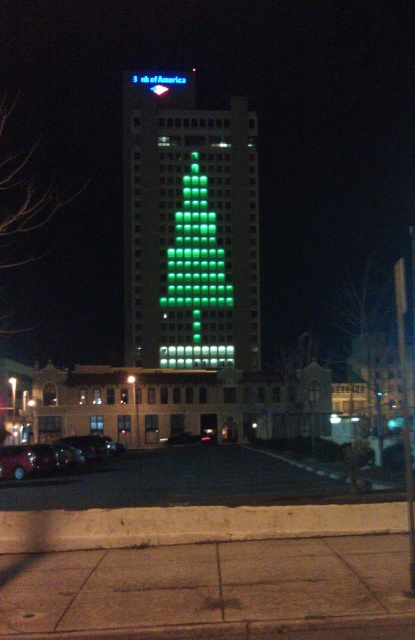
Question: Which point is closer to the camera taking this photo?

Choices:
 (A) (182, 76)
 (B) (63, 451)
 (C) (92, 444)

Answer: (B)

Question: Which of these objects is positioned farthest from the green led lights at center?

Choices:
 (A) shiny red car at lower left
 (B) shiny black sedan at lower left

Answer: (A)

Question: Is green led lights at center to the left of shiny black sedan at lower left from the viewer's perspective?

Choices:
 (A) yes
 (B) no

Answer: (A)

Question: Is shiny red car at lower left above shiny black sedan at lower left?

Choices:
 (A) no
 (B) yes

Answer: (B)

Question: Does shiny red car at lower left appear on the left side of green led sign at center?

Choices:
 (A) yes
 (B) no

Answer: (A)

Question: Which of these objects is positioned closest to the green led sign at center?

Choices:
 (A) green led lights at center
 (B) shiny red car at lower left
 (C) shiny black sedan at lower left

Answer: (A)